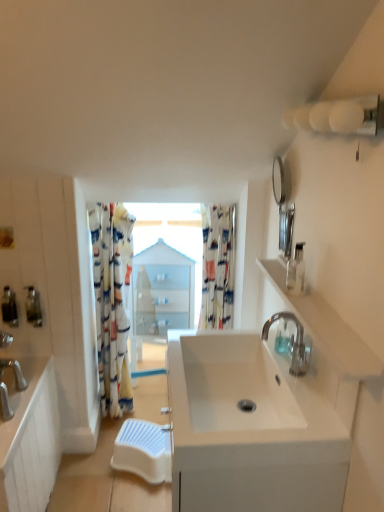
Where is `free spot above white plastic step stool at lower center (from a real-world perspective)`? free spot above white plastic step stool at lower center (from a real-world perspective) is located at coordinates (148, 434).